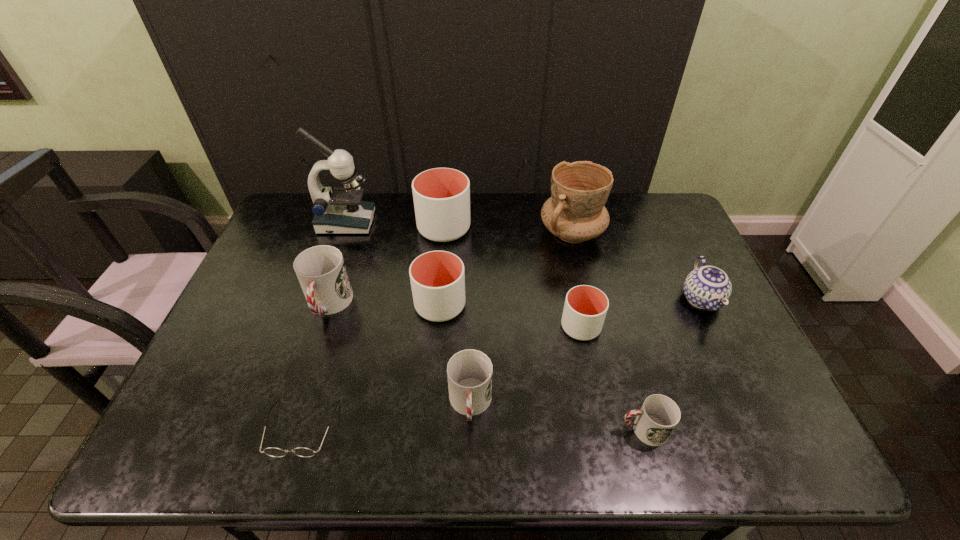
Locate an element on the screen. the second closest cup relative to the biggest white cup is located at coordinates (321, 271).

At what (x,y) coordinates should I click in order to perform the action: click on cup that is the fourth nearest to the second biggest white cup. Please return your answer as a coordinate pair (x, y). Looking at the image, I should click on (585, 308).

This screenshot has width=960, height=540. I want to click on white cup that stands as the second closest to the second smallest white cup, so click(585, 308).

This screenshot has height=540, width=960. Find the location of `the second closest white cup to the second smallest white cup`. the second closest white cup to the second smallest white cup is located at coordinates (585, 308).

Choose which red cup is the nearest neighbor to the second biggest red cup. Please provide its 2D coordinates. Your answer should be formatted as a tuple, i.e. [(x, y)], where the tuple contains the x and y coordinates of a point satisfying the conditions above.

[(659, 415)]

You are a GUI agent. You are given a task and a screenshot of the screen. Output one action in this format:
    pyautogui.click(x=<x>, y=<y>)
    Task: Click on the second closest red cup to the second biggest white cup
    
    Given the screenshot: What is the action you would take?
    pyautogui.click(x=321, y=271)

You are a GUI agent. You are given a task and a screenshot of the screen. Output one action in this format:
    pyautogui.click(x=<x>, y=<y>)
    Task: Click on the free space that satisfies the following two spatial constraints: 1. at the eyepiece of the microscope; 2. on the side of the shortest cup where the handle is located
    
    Given the screenshot: What is the action you would take?
    pyautogui.click(x=275, y=430)

The image size is (960, 540). What are the coordinates of `vacant point that satisfies the following two spatial constraints: 1. through the lenses of the dark spectacles; 2. on the side of the second shortest object where the handle is located` in the screenshot? It's located at (300, 430).